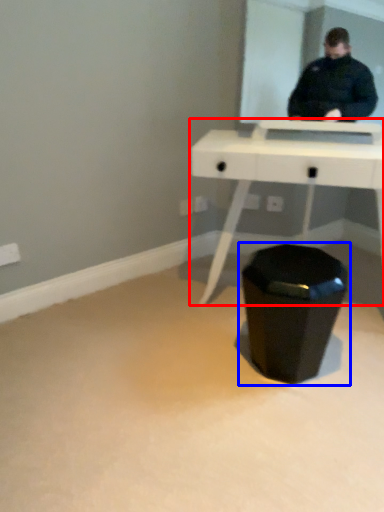
Question: Which object is closer to the camera taking this photo, table (highlighted by a red box) or waste container (highlighted by a blue box)?

Choices:
 (A) table
 (B) waste container

Answer: (A)